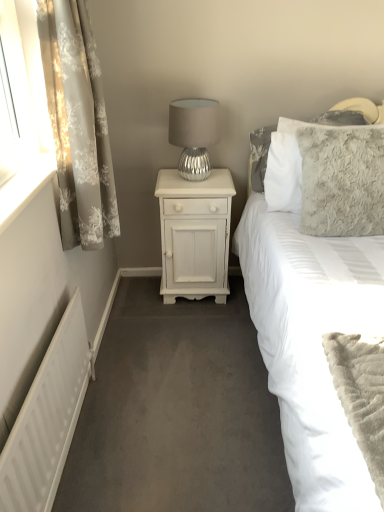
This screenshot has height=512, width=384. What are the coordinates of `vacant area on top of white matte radiator at lower left (from a real-world perspective)` in the screenshot? It's located at (39, 362).